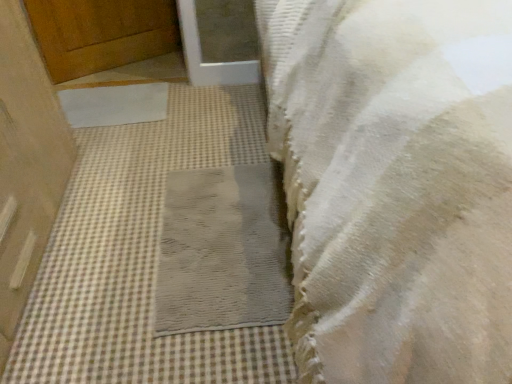
Question: Is wooden door at left, acting as the first door starting from the front, outside white matte mat at center, the 2th mat in the bottom-to-top sequence?

Choices:
 (A) no
 (B) yes

Answer: (B)

Question: Can white matte mat at center, marked as the 1th mat in a back-to-front arrangement, be found inside wooden door at left, acting as the first door starting from the front?

Choices:
 (A) yes
 (B) no

Answer: (B)

Question: Can you confirm if wooden door at left, acting as the first door starting from the front, is smaller than white matte mat at center, arranged as the 1th mat when viewed from the top?

Choices:
 (A) no
 (B) yes

Answer: (A)

Question: Considering the relative sizes of wooden door at left, which is the second door in top-to-bottom order, and white matte mat at center, arranged as the 1th mat when viewed from the top, in the image provided, is wooden door at left, which is the second door in top-to-bottom order, taller than white matte mat at center, arranged as the 1th mat when viewed from the top,?

Choices:
 (A) yes
 (B) no

Answer: (A)

Question: Is white matte mat at center, the 2th mat in the bottom-to-top sequence, at the back of wooden door at left, which is the second door in top-to-bottom order?

Choices:
 (A) yes
 (B) no

Answer: (B)

Question: Are wooden door at left, positioned as the 1th door in bottom-to-top order, and white matte mat at center, arranged as the 1th mat when viewed from the top, beside each other?

Choices:
 (A) yes
 (B) no

Answer: (B)

Question: Is white textured towel at lower right thinner than white matte mat at center, the 2th mat in the front-to-back sequence?

Choices:
 (A) no
 (B) yes

Answer: (A)

Question: Does white textured towel at lower right come behind white matte mat at center, the 2th mat in the front-to-back sequence?

Choices:
 (A) yes
 (B) no

Answer: (B)

Question: Is white textured towel at lower right not within white matte mat at center, arranged as the 1th mat when viewed from the top?

Choices:
 (A) no
 (B) yes

Answer: (B)

Question: Is white textured towel at lower right oriented towards white matte mat at center, arranged as the 1th mat when viewed from the top?

Choices:
 (A) no
 (B) yes

Answer: (A)

Question: Considering the relative positions of white textured towel at lower right and white matte mat at center, marked as the 1th mat in a back-to-front arrangement, in the image provided, is white textured towel at lower right to the left of white matte mat at center, marked as the 1th mat in a back-to-front arrangement, from the viewer's perspective?

Choices:
 (A) no
 (B) yes

Answer: (A)

Question: Is white textured towel at lower right shorter than white matte mat at center, the 2th mat in the front-to-back sequence?

Choices:
 (A) yes
 (B) no

Answer: (B)

Question: Is white matte mat at center, the first mat positioned from the left, oriented away from wooden door at upper left, which is the first door from top to bottom?

Choices:
 (A) yes
 (B) no

Answer: (A)